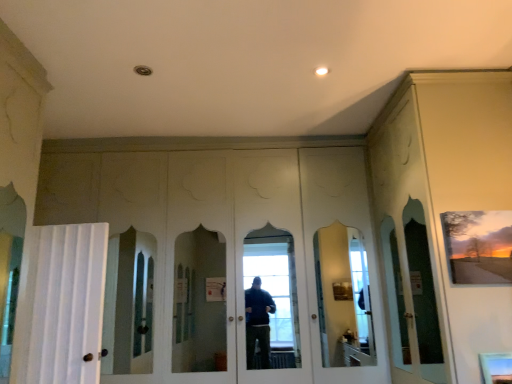
Question: Relative to matte glass window at lower right, is matte wooden picture frame at upper right in front or behind?

Choices:
 (A) front
 (B) behind

Answer: (B)

Question: From their relative heights in the image, would you say matte wooden picture frame at upper right is taller or shorter than matte glass window at lower right?

Choices:
 (A) short
 (B) tall

Answer: (B)

Question: Which object is the farthest from the matte wooden picture frame at upper right?

Choices:
 (A) white fabric curtain at left
 (B) matte glass window at lower right

Answer: (A)

Question: Which of these objects is positioned farthest from the matte wooden picture frame at upper right?

Choices:
 (A) white fabric curtain at left
 (B) matte glass window at lower right

Answer: (A)